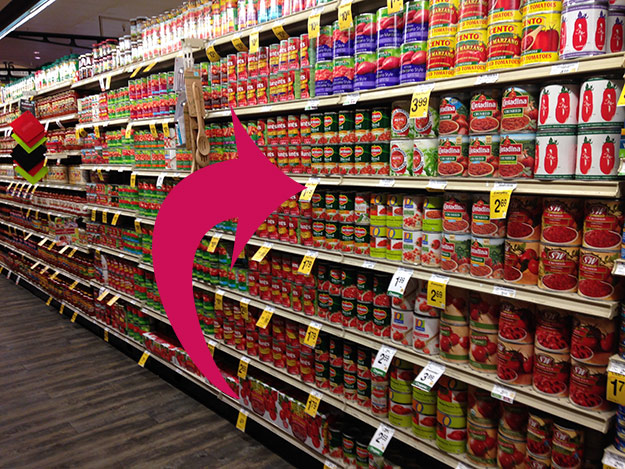
I want to click on hunts tomato products on third shelf from bottom, so click(x=265, y=293), click(x=280, y=299), click(x=301, y=306), click(x=309, y=311), click(x=250, y=287).